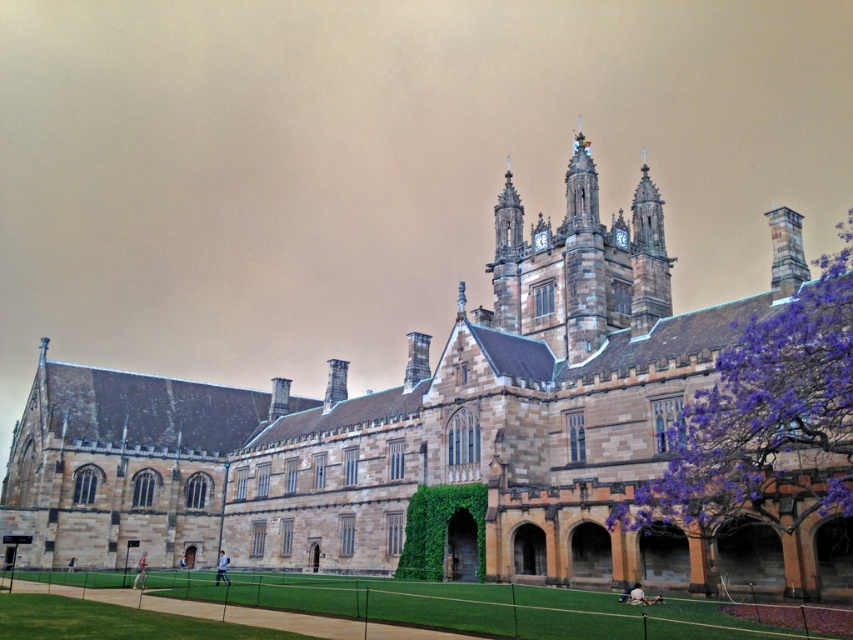
You are standing in front of the grand historic building and want to take a photo of the purple wood tree at right. Where should you position yourself to ensure the tree is centered in your camera frame?

To center the purple wood tree at right in your camera frame, position yourself directly in front of the tree at its 2D location coordinates point (764, 420).

You are standing 30 meters away from the historic building. You want to walk towards the purple wood tree at right. How many more meters do you need to walk to reach the tree?

The purple wood tree at right is 36.66 meters away from the viewer. Since you are already 30 meters away from the building, you need to walk an additional 6.66 meters to reach the tree.